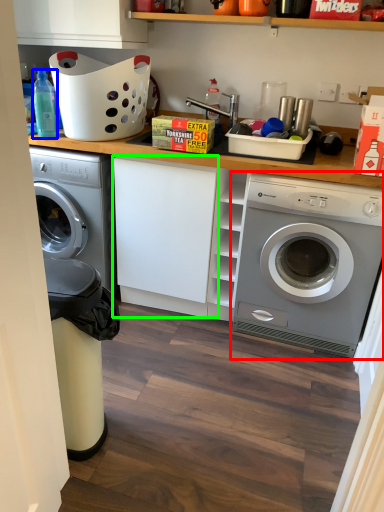
Question: Which is nearer to the washing machine (highlighted by a red box)? bottle (highlighted by a blue box) or cabinetry (highlighted by a green box).

Choices:
 (A) bottle
 (B) cabinetry

Answer: (B)